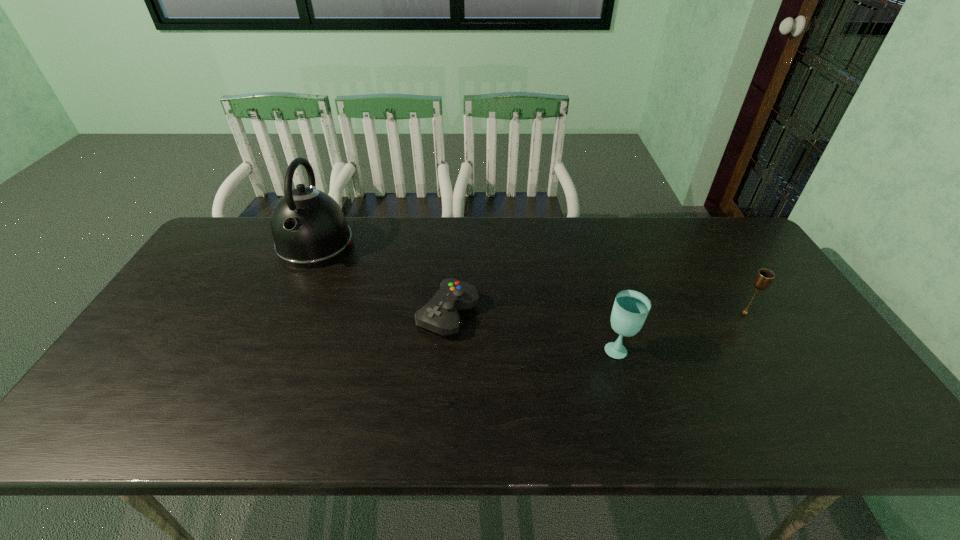
The image size is (960, 540). I want to click on kettle, so click(309, 229).

Where is `the farthest object`? This screenshot has height=540, width=960. the farthest object is located at coordinates (309, 229).

Find the location of a particular element. This screenshot has height=540, width=960. the third object from left to right is located at coordinates (630, 309).

Identify the location of glass. The height and width of the screenshot is (540, 960). (x=630, y=309).

In order to click on chalice in this screenshot , I will do (x=764, y=277).

Locate an element on the screen. The image size is (960, 540). the rightmost object is located at coordinates (764, 277).

This screenshot has width=960, height=540. What are the coordinates of `the shortest object` in the screenshot? It's located at (439, 315).

The height and width of the screenshot is (540, 960). Find the location of `control`. control is located at coordinates (439, 315).

This screenshot has height=540, width=960. Find the location of `free location located 0.100m on the spout of the kettle`. free location located 0.100m on the spout of the kettle is located at coordinates (293, 295).

This screenshot has width=960, height=540. In order to click on blank space located on the right of the second tallest object in this screenshot , I will do `click(685, 349)`.